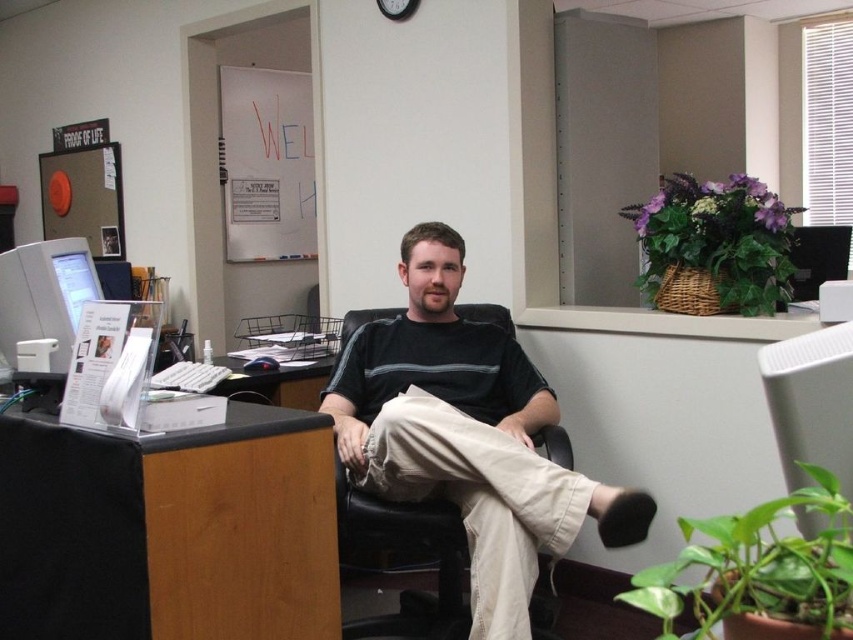
Question: Is black matte computer desk at lower left positioned at the back of dark gray striped shirt at center?

Choices:
 (A) no
 (B) yes

Answer: (A)

Question: Does black matte computer desk at lower left have a smaller size compared to dark gray striped shirt at center?

Choices:
 (A) no
 (B) yes

Answer: (B)

Question: Is black matte computer desk at lower left to the left of dark gray striped shirt at center from the viewer's perspective?

Choices:
 (A) no
 (B) yes

Answer: (B)

Question: Which object appears closest to the camera in this image?

Choices:
 (A) black matte computer desk at lower left
 (B) dark gray striped shirt at center

Answer: (A)

Question: Which point is farther from the camera taking this photo?

Choices:
 (A) (422, 253)
 (B) (27, 624)

Answer: (A)